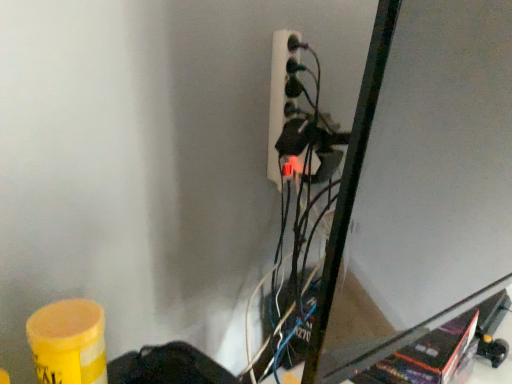
Question: Which direction should I rotate to look at white plastic power plugs and sockets at upper center?

Choices:
 (A) left
 (B) right

Answer: (B)

Question: From a real-world perspective, is yellow matte barrel at lower left located beneath white plastic power plugs and sockets at upper center?

Choices:
 (A) no
 (B) yes

Answer: (B)

Question: Is yellow matte barrel at lower left outside white plastic power plugs and sockets at upper center?

Choices:
 (A) no
 (B) yes

Answer: (B)

Question: Does yellow matte barrel at lower left have a greater width compared to white plastic power plugs and sockets at upper center?

Choices:
 (A) yes
 (B) no

Answer: (A)

Question: Can white plastic power plugs and sockets at upper center be found inside yellow matte barrel at lower left?

Choices:
 (A) no
 (B) yes

Answer: (A)

Question: Does yellow matte barrel at lower left have a lesser height compared to white plastic power plugs and sockets at upper center?

Choices:
 (A) yes
 (B) no

Answer: (A)

Question: Does yellow matte barrel at lower left have a smaller size compared to white plastic power plugs and sockets at upper center?

Choices:
 (A) yes
 (B) no

Answer: (A)

Question: Is white plastic power plugs and sockets at upper center wider than yellow matte barrel at lower left?

Choices:
 (A) no
 (B) yes

Answer: (A)

Question: Does white plastic power plugs and sockets at upper center have a larger size compared to yellow matte barrel at lower left?

Choices:
 (A) yes
 (B) no

Answer: (A)

Question: Is white plastic power plugs and sockets at upper center at the left side of yellow matte barrel at lower left?

Choices:
 (A) no
 (B) yes

Answer: (A)

Question: Is yellow matte barrel at lower left a part of white plastic power plugs and sockets at upper center?

Choices:
 (A) no
 (B) yes

Answer: (A)

Question: Is white plastic power plugs and sockets at upper center positioned with its back to yellow matte barrel at lower left?

Choices:
 (A) yes
 (B) no

Answer: (B)

Question: Considering the relative positions of white plastic power plugs and sockets at upper center and yellow matte barrel at lower left in the image provided, is white plastic power plugs and sockets at upper center to the right of yellow matte barrel at lower left from the viewer's perspective?

Choices:
 (A) no
 (B) yes

Answer: (B)

Question: From a real-world perspective, is yellow matte barrel at lower left positioned above or below white plastic power plugs and sockets at upper center?

Choices:
 (A) below
 (B) above

Answer: (A)